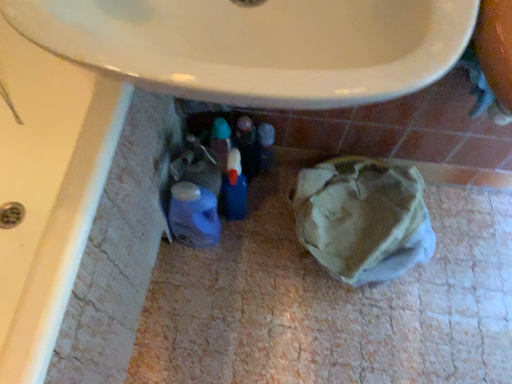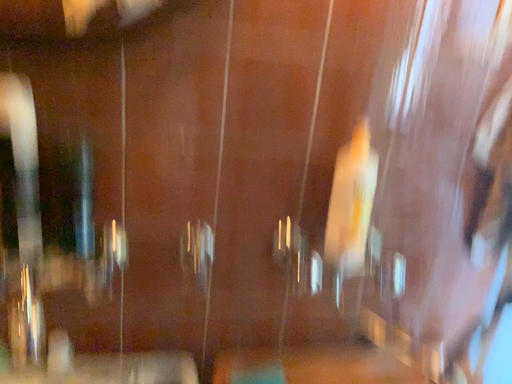
Question: Which way did the camera rotate in the video?

Choices:
 (A) rotated right
 (B) rotated left

Answer: (A)